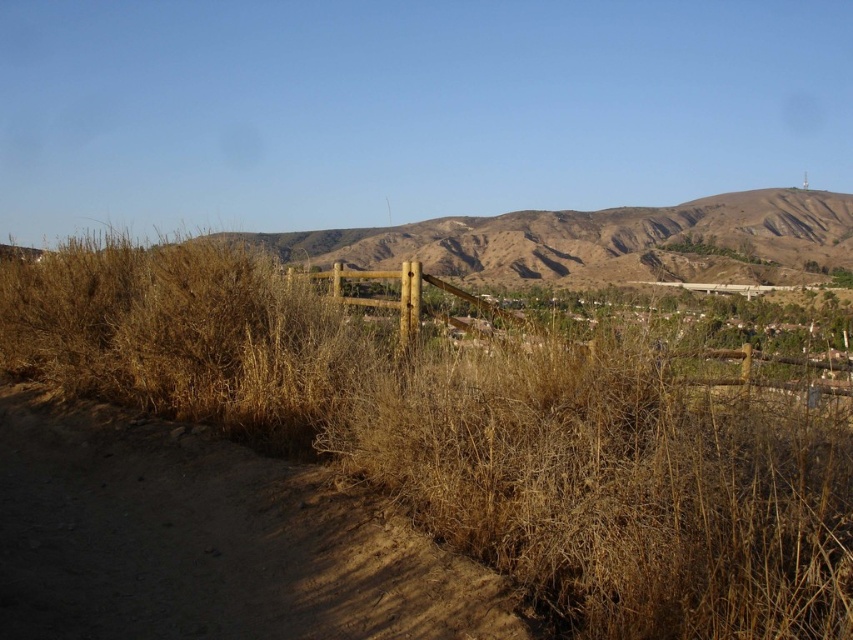
In the scene shown: Does brown dirt track at lower left appear over brown wooden fence at center?

No.

Is brown dirt track at lower left bigger than brown wooden fence at center?

Incorrect, brown dirt track at lower left is not larger than brown wooden fence at center.

Is point (28, 497) behind point (750, 369)?

That is False.

The width and height of the screenshot is (853, 640). Find the location of `brown dirt track at lower left`. brown dirt track at lower left is located at coordinates pos(213,540).

Can you confirm if dry straw at center is wider than brown dirt track at lower left?

Indeed, dry straw at center has a greater width compared to brown dirt track at lower left.

Describe the element at coordinates (474, 438) in the screenshot. I see `dry straw at center` at that location.

Locate an element on the screen. dry straw at center is located at coordinates (474, 438).

The height and width of the screenshot is (640, 853). Find the location of `dry straw at center`. dry straw at center is located at coordinates (474, 438).

Is dry straw at center positioned at the back of brown wooden fence at center?

No, it is not.

Who is more distant from viewer, (x=76, y=353) or (x=834, y=394)?

Positioned behind is point (x=76, y=353).

You are a GUI agent. You are given a task and a screenshot of the screen. Output one action in this format:
    pyautogui.click(x=<x>, y=<y>)
    Task: Click on the dry straw at center
    The width and height of the screenshot is (853, 640).
    Given the screenshot: What is the action you would take?
    pyautogui.click(x=474, y=438)